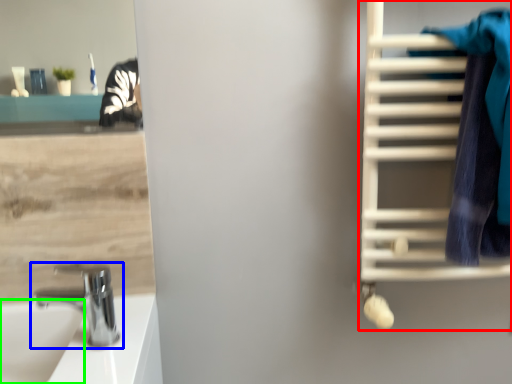
Question: Based on their relative distances, which object is nearer to bunk bed (highlighted by a red box)? Choose from tap (highlighted by a blue box) and sink (highlighted by a green box).

Choices:
 (A) tap
 (B) sink

Answer: (A)